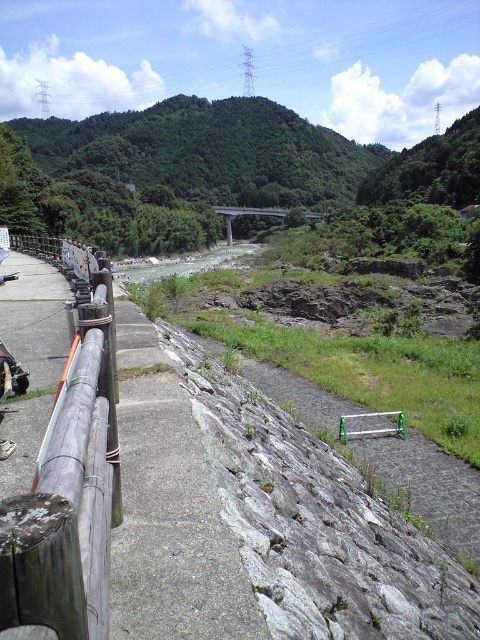
Which is below, brown wood rail at left or clear water at center?

brown wood rail at left

Does brown wood rail at left appear over clear water at center?

No, brown wood rail at left is not above clear water at center.

Describe the element at coordinates (68, 497) in the screenshot. I see `brown wood rail at left` at that location.

What are the coordinates of `brown wood rail at left` in the screenshot? It's located at (68, 497).

Between point (158, 492) and point (168, 273), which one is positioned behind?

The point (168, 273) is more distant.

Which of these two, gray concrete path at center or clear water at center, stands shorter?

With less height is gray concrete path at center.

What are the coordinates of `gray concrete path at center` in the screenshot? It's located at (169, 509).

In the scene shown: Between gray concrete path at center and brown wood rail at left, which one is positioned lower?

gray concrete path at center

Which is in front, point (208, 589) or point (60, 637)?

Point (60, 637)

What do you see at coordinates (169, 509) in the screenshot? I see `gray concrete path at center` at bounding box center [169, 509].

At what (x,y) coordinates should I click in order to perform the action: click on gray concrete path at center. Please return your answer as a coordinate pair (x, y). This screenshot has height=640, width=480. Looking at the image, I should click on (169, 509).